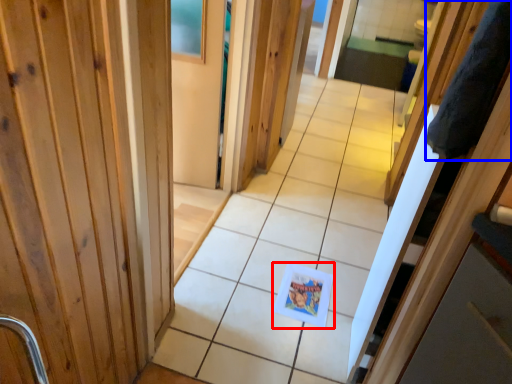
Question: Which object appears farthest to the camera in this image, postcard (highlighted by a red box) or robe (highlighted by a blue box)?

Choices:
 (A) postcard
 (B) robe

Answer: (A)